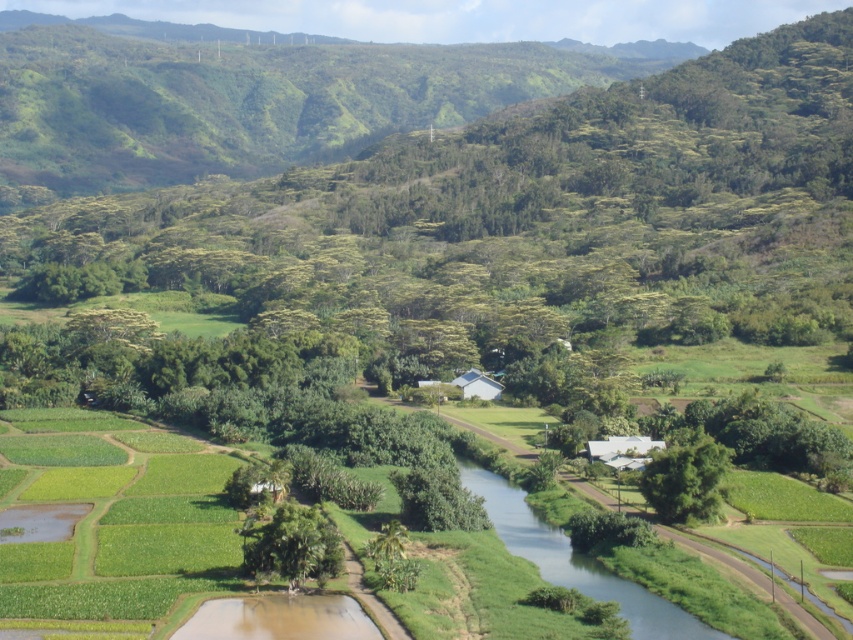
Consider the image. You are a hiker who wants to cross the green grassy stream at center and the green leafy tree at center. Which one can you physically step over?

The green grassy stream at center has a lesser height compared to green leafy tree at center, so you can physically step over the green grassy stream at center.